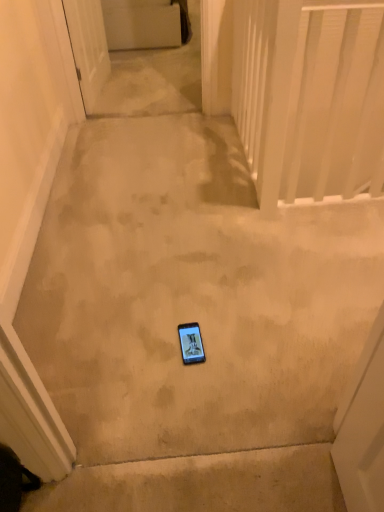
Question: Should I look upward or downward to see white plastic balustrade at upper right?

Choices:
 (A) down
 (B) up

Answer: (B)

Question: Is matte black phone at center to the left of white glossy door at upper left from the viewer's perspective?

Choices:
 (A) yes
 (B) no

Answer: (B)

Question: Would you say matte black phone at center is outside white glossy door at upper left?

Choices:
 (A) no
 (B) yes

Answer: (B)

Question: Is matte black phone at center taller than white glossy door at upper left?

Choices:
 (A) yes
 (B) no

Answer: (B)

Question: Is matte black phone at center not near white glossy door at upper left?

Choices:
 (A) no
 (B) yes

Answer: (B)

Question: Can you confirm if matte black phone at center is shorter than white glossy door at upper left?

Choices:
 (A) no
 (B) yes

Answer: (B)

Question: Does matte black phone at center touch white glossy door at upper left?

Choices:
 (A) yes
 (B) no

Answer: (B)

Question: Can you confirm if white glossy door at upper left is bigger than white plastic balustrade at upper right?

Choices:
 (A) no
 (B) yes

Answer: (B)

Question: Could white plastic balustrade at upper right be considered to be inside white glossy door at upper left?

Choices:
 (A) yes
 (B) no

Answer: (B)

Question: Can you confirm if white glossy door at upper left is taller than white plastic balustrade at upper right?

Choices:
 (A) yes
 (B) no

Answer: (B)

Question: Is white glossy door at upper left positioned far away from white plastic balustrade at upper right?

Choices:
 (A) no
 (B) yes

Answer: (B)

Question: Is white glossy door at upper left oriented away from white plastic balustrade at upper right?

Choices:
 (A) yes
 (B) no

Answer: (B)

Question: From the image's perspective, is white glossy door at upper left below white plastic balustrade at upper right?

Choices:
 (A) no
 (B) yes

Answer: (A)

Question: Is white glossy door at upper left not near matte black phone at center?

Choices:
 (A) yes
 (B) no

Answer: (A)